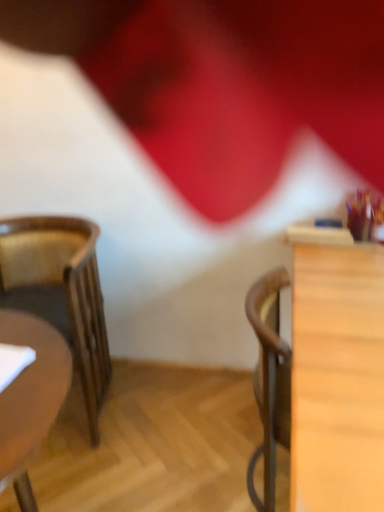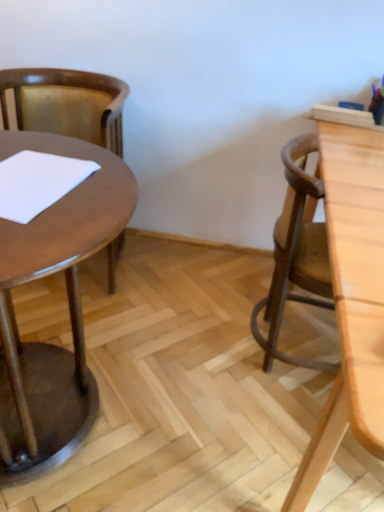
Question: Which way did the camera rotate in the video?

Choices:
 (A) rotated downward
 (B) rotated upward

Answer: (A)